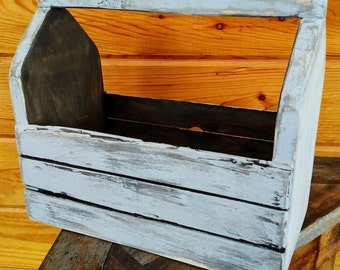
You are a GUI agent. You are given a task and a screenshot of the screen. Output one action in this format:
    pyautogui.click(x=<x>, y=<y>)
    Task: Click on the wall
    
    Given the screenshot: What is the action you would take?
    pyautogui.click(x=225, y=81)